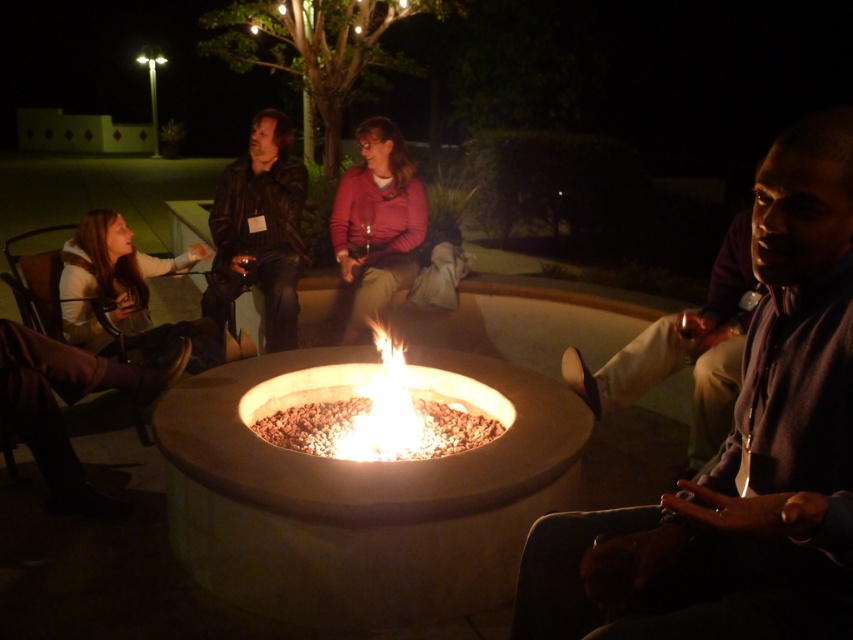
Question: Among these objects, which one is nearest to the camera?

Choices:
 (A) flameing stonelike fire pit at center
 (B) dark brown leather shoe at lower right
 (C) dark blue shirt at center

Answer: (C)

Question: Does dark blue shirt at center have a greater width compared to dark brown leather shoe at lower right?

Choices:
 (A) no
 (B) yes

Answer: (A)

Question: Does concrete fire pit at center have a larger size compared to leather jacket at center?

Choices:
 (A) yes
 (B) no

Answer: (A)

Question: Which object appears farthest from the camera in this image?

Choices:
 (A) dark blue shirt at center
 (B) flameing stonelike fire pit at center
 (C) flamematerial/texture at center
 (D) concrete fire pit at center

Answer: (C)

Question: Which of the following is the farthest from the observer?

Choices:
 (A) (349, 452)
 (B) (439, 460)

Answer: (A)

Question: Is the position of flameing stonelike fire pit at center more distant than that of flamematerial/texture at center?

Choices:
 (A) no
 (B) yes

Answer: (A)